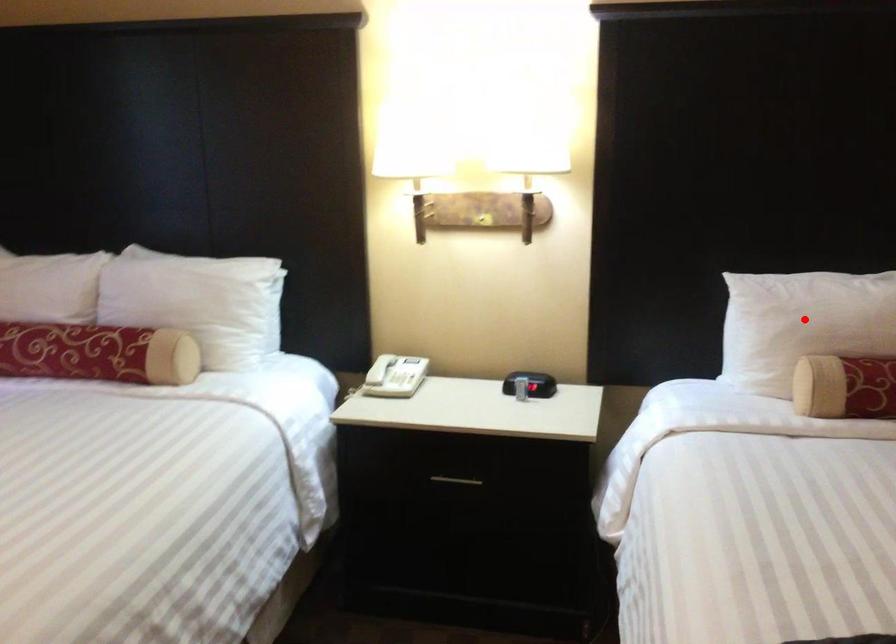
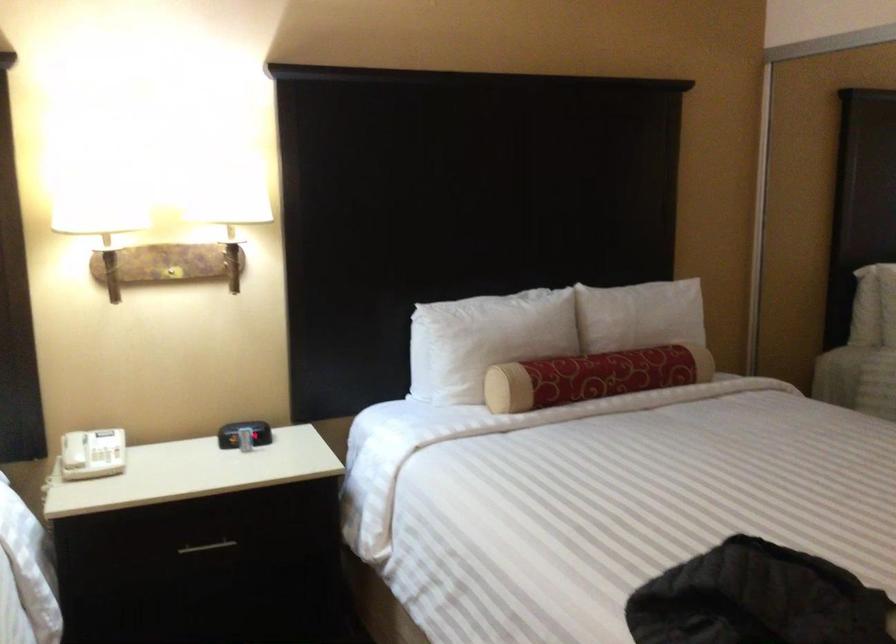
Locate, in the second image, the point that corresponds to the highlighted location in the first image.

(485, 339)